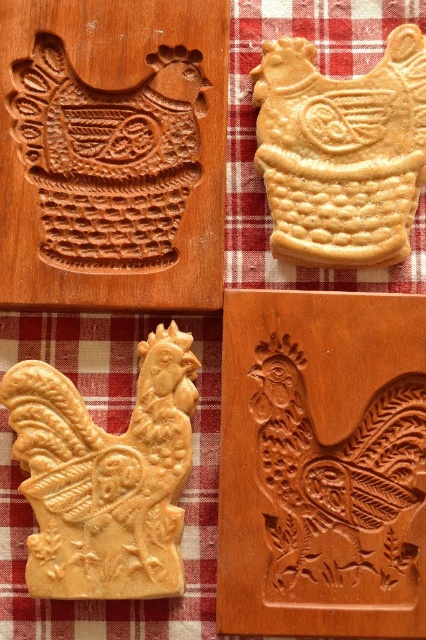
Which is behind, point (176, 588) or point (284, 83)?

Positioned behind is point (284, 83).

Does golden-brown cookie at center-left appear over golden-brown cookie at upper center?

Incorrect, golden-brown cookie at center-left is not positioned above golden-brown cookie at upper center.

Where is `golden-brown cookie at center-left`? The height and width of the screenshot is (640, 426). golden-brown cookie at center-left is located at coordinates (106, 476).

Where is `golden-brown cookie at center-left`? golden-brown cookie at center-left is located at coordinates (106, 476).

Which of these two, wooden carving at center or golden-brown cookie at center-left, stands taller?

wooden carving at center is taller.

The image size is (426, 640). I want to click on wooden carving at center, so click(112, 152).

Does point (55, 205) come farther from viewer compared to point (370, 156)?

No, it is in front of (370, 156).

Who is positioned more to the right, wooden carving at center or golden-brown cookie at upper center?

From the viewer's perspective, golden-brown cookie at upper center appears more on the right side.

This screenshot has height=640, width=426. Find the location of `wooden carving at center`. wooden carving at center is located at coordinates (112, 152).